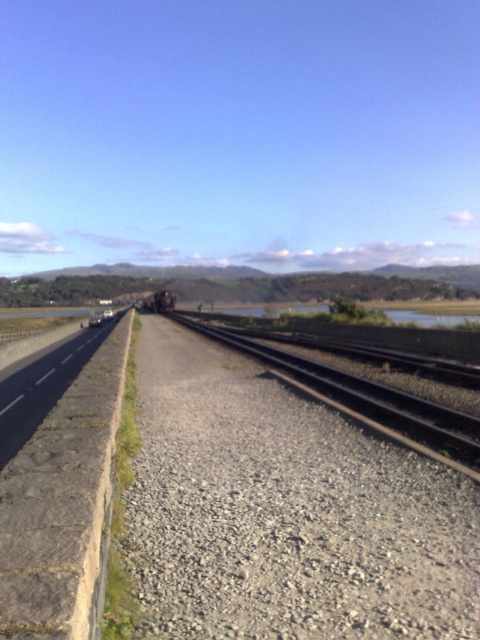
I want to click on metal train track at center, so click(x=368, y=403).

Is point (385, 426) closer to camera compared to point (164, 301)?

Yes, point (385, 426) is in front of point (164, 301).

Identify the location of metal train track at center. The width and height of the screenshot is (480, 640). (368, 403).

Which is more to the left, gray concrete highway at left or metal train track at center?

Positioned to the left is gray concrete highway at left.

Describe the element at coordinates (62, 506) in the screenshot. I see `gray concrete highway at left` at that location.

What do you see at coordinates (62, 506) in the screenshot? I see `gray concrete highway at left` at bounding box center [62, 506].

Find the location of a particular element. gray concrete highway at left is located at coordinates (62, 506).

Who is shorter, gray concrete highway at left or metallic gray train at center?

gray concrete highway at left is shorter.

Between point (110, 353) and point (158, 296), which one is positioned behind?

The point (158, 296) is behind.

Is point (86, 396) closer to camera compared to point (162, 296)?

Yes, point (86, 396) is in front of point (162, 296).

Where is `gray concrete highway at left`? Image resolution: width=480 pixels, height=640 pixels. gray concrete highway at left is located at coordinates tap(62, 506).